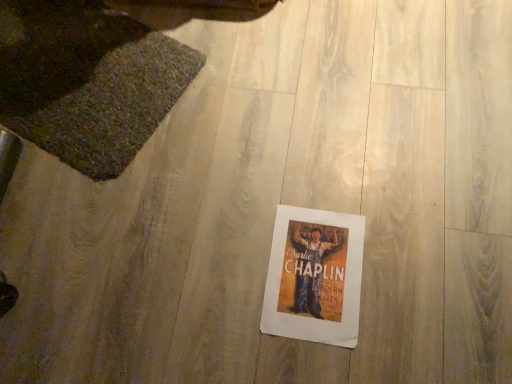
The width and height of the screenshot is (512, 384). What do you see at coordinates (314, 276) in the screenshot? I see `white paper poster at center` at bounding box center [314, 276].

Identify the location of white paper poster at center. (314, 276).

Measure the distance between point [329,223] and camera.

A distance of 3.31 feet exists between point [329,223] and camera.

The height and width of the screenshot is (384, 512). What do you see at coordinates (87, 81) in the screenshot? I see `textured woolen mat at upper left` at bounding box center [87, 81].

You are a GUI agent. You are given a task and a screenshot of the screen. Output one action in this format:
    pyautogui.click(x=<x>, y=<y>)
    Task: Click on the textured woolen mat at upper left
    
    Given the screenshot: What is the action you would take?
    pyautogui.click(x=87, y=81)

What is the approximate height of textured woolen mat at upper left?

textured woolen mat at upper left is 2.54 inches in height.

This screenshot has height=384, width=512. What are the coordinates of `white paper poster at center` in the screenshot? It's located at [314, 276].

Between white paper poster at center and textured woolen mat at upper left, which one appears on the right side from the viewer's perspective?

white paper poster at center is more to the right.

Is the position of white paper poster at center less distant than that of textured woolen mat at upper left?

Yes, white paper poster at center is closer to the viewer.

Which is closer to the camera, (346, 326) or (77, 8)?

The point (346, 326) is in front.

From the image's perspective, is white paper poster at center located above or below textured woolen mat at upper left?

From the image's perspective, white paper poster at center appears below textured woolen mat at upper left.

In the scene shown: From a real-world perspective, is white paper poster at center above or below textured woolen mat at upper left?

In terms of real-world spatial position, white paper poster at center is below textured woolen mat at upper left.

Considering the sizes of white paper poster at center and textured woolen mat at upper left in the image, is white paper poster at center wider or thinner than textured woolen mat at upper left?

Clearly, white paper poster at center has less width compared to textured woolen mat at upper left.

Which of these two, white paper poster at center or textured woolen mat at upper left, stands shorter?

white paper poster at center is shorter.

Between white paper poster at center and textured woolen mat at upper left, which one has larger size?

textured woolen mat at upper left is bigger.

Is white paper poster at center not within textured woolen mat at upper left?

That's correct, white paper poster at center is outside of textured woolen mat at upper left.

Is white paper poster at center not close to textured woolen mat at upper left?

No, white paper poster at center is not far from textured woolen mat at upper left.

Could you tell me if white paper poster at center is facing textured woolen mat at upper left?

No, white paper poster at center is not oriented towards textured woolen mat at upper left.

From the picture: What's the angular difference between white paper poster at center and textured woolen mat at upper left's facing directions?

The angle between the facing direction of white paper poster at center and the facing direction of textured woolen mat at upper left is 114 degrees.

From the picture: How much distance is there between white paper poster at center and textured woolen mat at upper left?

white paper poster at center and textured woolen mat at upper left are 24.07 inches apart from each other.

I want to click on mat on the left of white paper poster at center, so click(87, 81).

Between textured woolen mat at upper left and white paper poster at center, which one appears on the left side from the viewer's perspective?

textured woolen mat at upper left is more to the left.

Which object is further away from the camera, textured woolen mat at upper left or white paper poster at center?

textured woolen mat at upper left is behind.

Which point is more distant from viewer, (63, 74) or (292, 233)?

The point (63, 74) is farther.

From the image's perspective, is textured woolen mat at upper left positioned above or below white paper poster at center?

Clearly, from the image's perspective, textured woolen mat at upper left is above white paper poster at center.

From a real-world perspective, who is located lower, textured woolen mat at upper left or white paper poster at center?

In real-world perspective, white paper poster at center is lower.

Consider the image. Is textured woolen mat at upper left thinner than white paper poster at center?

No, textured woolen mat at upper left is not thinner than white paper poster at center.

Based on the photo, considering the sizes of textured woolen mat at upper left and white paper poster at center in the image, is textured woolen mat at upper left taller or shorter than white paper poster at center?

Considering their sizes, textured woolen mat at upper left has more height than white paper poster at center.

Is textured woolen mat at upper left bigger than white paper poster at center?

Correct, textured woolen mat at upper left is larger in size than white paper poster at center.

Is textured woolen mat at upper left inside or outside of white paper poster at center?

textured woolen mat at upper left lies outside white paper poster at center.

Is textured woolen mat at upper left far from white paper poster at center?

No, textured woolen mat at upper left is not far away from white paper poster at center.

Is textured woolen mat at upper left positioned with its back to white paper poster at center?

textured woolen mat at upper left is not turned away from white paper poster at center.

Based on the photo, how different are the orientations of textured woolen mat at upper left and white paper poster at center in degrees?

textured woolen mat at upper left and white paper poster at center are facing 114 degrees away from each other.

Identify the location of mat that appears behind the white paper poster at center. The height and width of the screenshot is (384, 512). (87, 81).

You are a GUI agent. You are given a task and a screenshot of the screen. Output one action in this format:
    pyautogui.click(x=<x>, y=<y>)
    Task: Click on the mat on the left of the white paper poster at center
    
    Given the screenshot: What is the action you would take?
    (x=87, y=81)

You are a GUI agent. You are given a task and a screenshot of the screen. Output one action in this format:
    pyautogui.click(x=<x>, y=<y>)
    Task: Click on the poster that is in front of the textured woolen mat at upper left
    
    Given the screenshot: What is the action you would take?
    pyautogui.click(x=314, y=276)